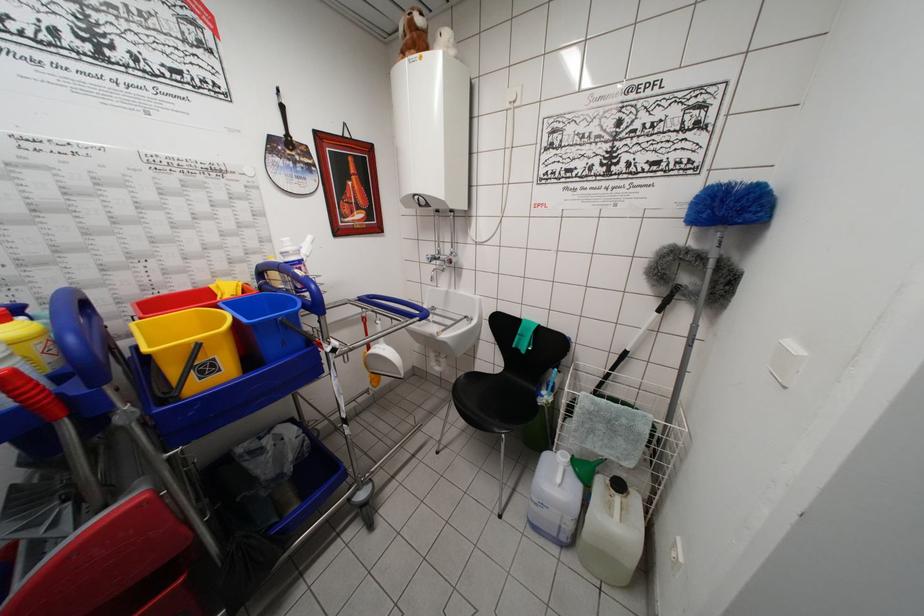
Find the location of a particular element. grey long-handled duster is located at coordinates (681, 286).